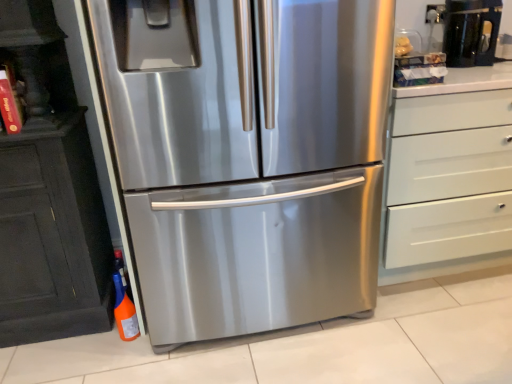
Question: From their relative heights in the image, would you say white matte chest of drawers at right is taller or shorter than orange matte bottle at lower left?

Choices:
 (A) tall
 (B) short

Answer: (A)

Question: Looking at the image, does white matte chest of drawers at right seem bigger or smaller compared to orange matte bottle at lower left?

Choices:
 (A) big
 (B) small

Answer: (A)

Question: Which object is positioned closest to the stainless steel refrigerator at center?

Choices:
 (A) black glossy coffee machine at upper right
 (B) orange matte bottle at lower left
 (C) white matte chest of drawers at right

Answer: (C)

Question: Which of these objects is positioned closest to the white matte chest of drawers at right?

Choices:
 (A) black glossy coffee machine at upper right
 (B) stainless steel refrigerator at center
 (C) orange matte bottle at lower left

Answer: (B)